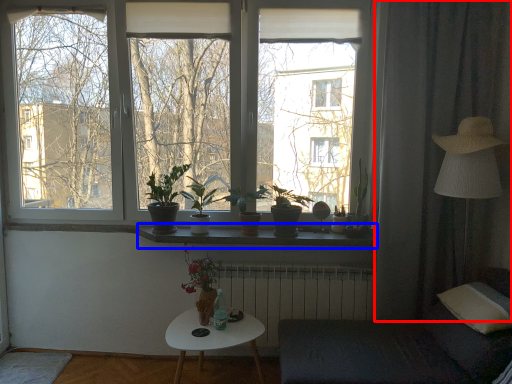
Question: Which object is closer to the camera taking this photo, curtain (highlighted by a red box) or window sill (highlighted by a blue box)?

Choices:
 (A) curtain
 (B) window sill

Answer: (A)